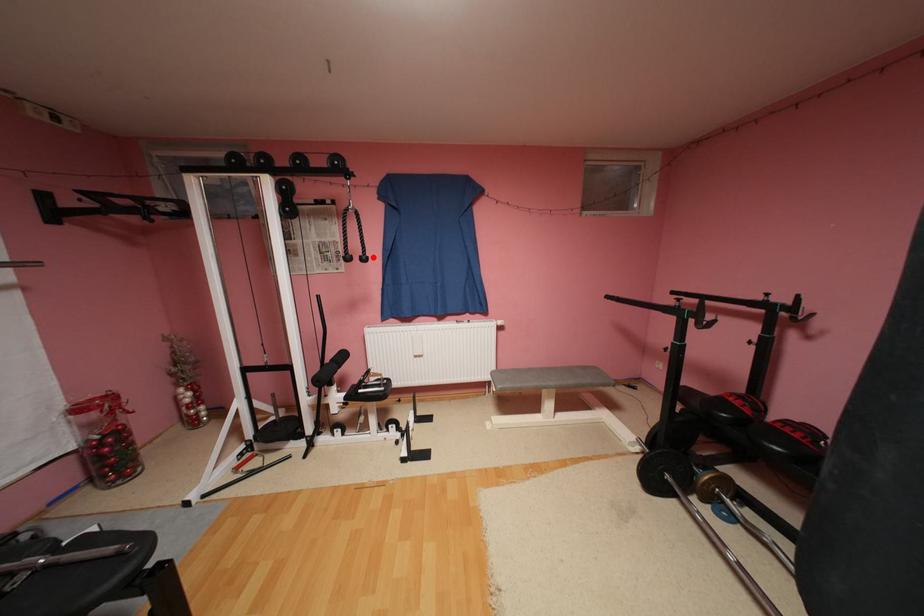
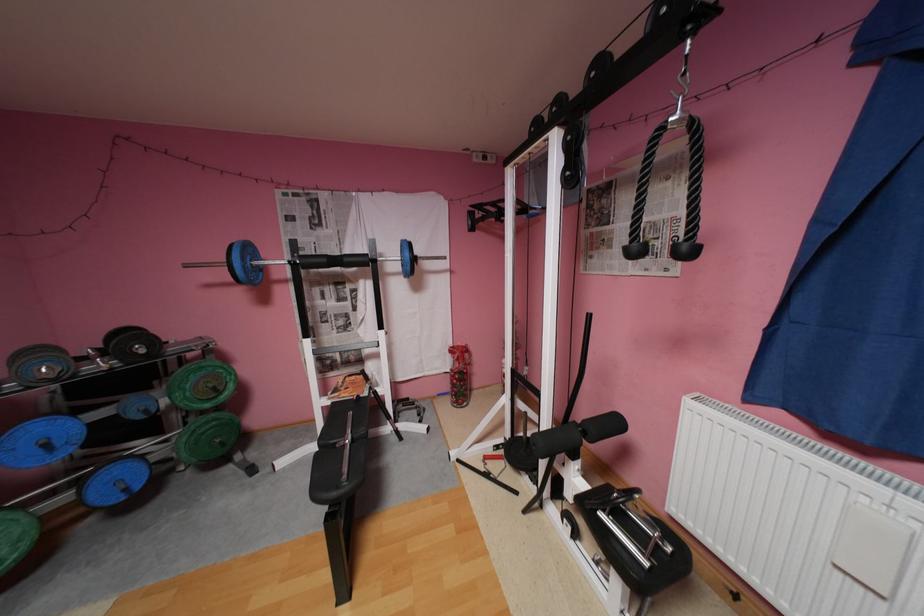
Where in the second image is the point corresponding to the highlighted location from the first image?

(695, 246)